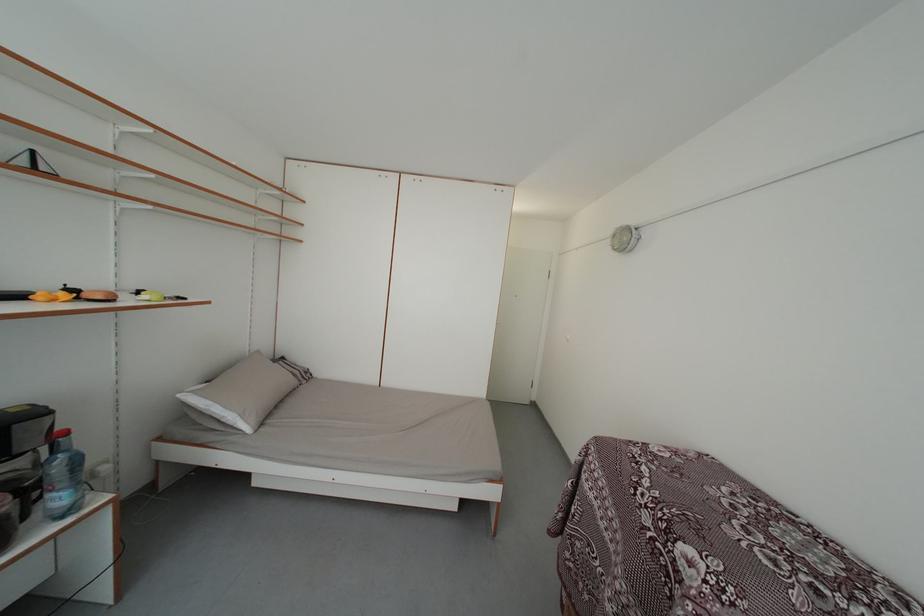
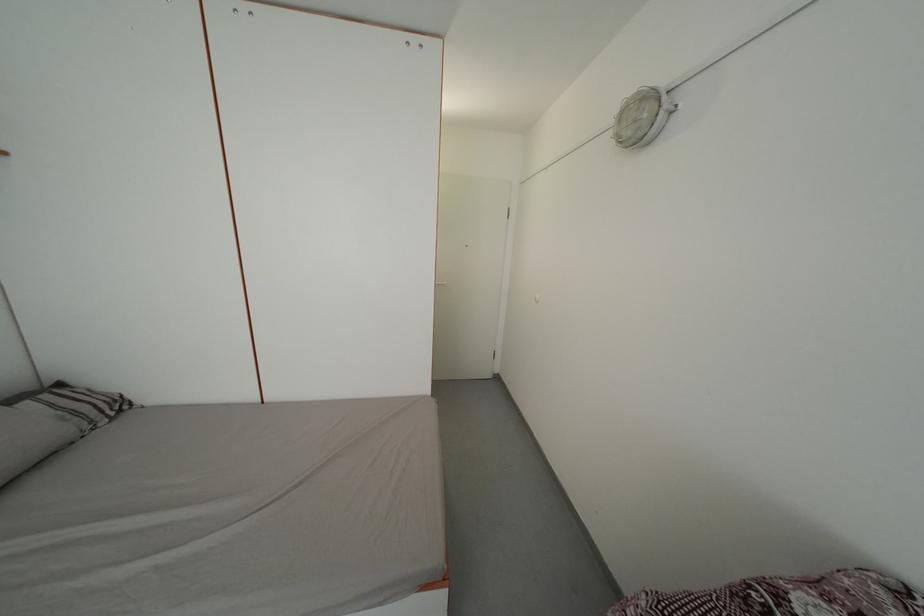
Question: Based on the continuous images, in which direction is the camera rotating? Reply with the corresponding letter.

Choices:
 (A) Left
 (B) Right
 (C) Up
 (D) Down

Answer: (D)